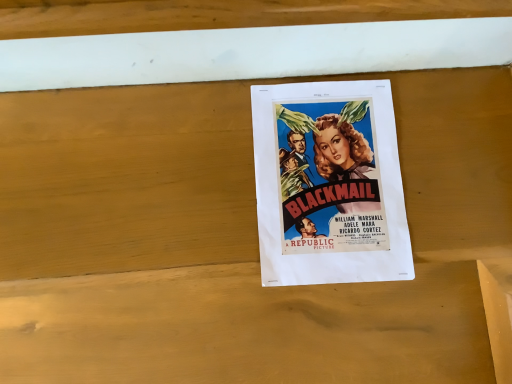
This screenshot has height=384, width=512. I want to click on white paper at upper center, so click(x=252, y=53).

What do you see at coordinates (252, 53) in the screenshot? I see `white paper at upper center` at bounding box center [252, 53].

Locate an element on the screen. This screenshot has width=512, height=384. white paper at upper center is located at coordinates (252, 53).